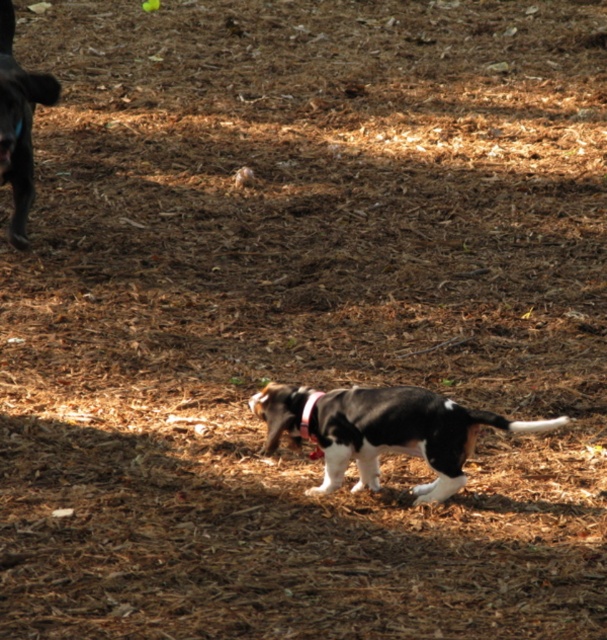
Image resolution: width=607 pixels, height=640 pixels. What are the coordinates of `shiny black dog at upper left` in the screenshot? It's located at (x=18, y=124).

Based on the photo, is black and white fur dog at center above shiny black dog at upper left?

Incorrect, black and white fur dog at center is not positioned above shiny black dog at upper left.

Does black and white fur dog at center have a lesser width compared to shiny black dog at upper left?

No.

You are a GUI agent. You are given a task and a screenshot of the screen. Output one action in this format:
    pyautogui.click(x=<x>, y=<y>)
    Task: Click on the black and white fur dog at center
    
    Given the screenshot: What is the action you would take?
    pyautogui.click(x=401, y=435)

Between black and white fur dog at center and black fabric neckband at center, which one appears on the left side from the viewer's perspective?

black fabric neckband at center

Between point (337, 472) and point (317, 444), which one is positioned in front?

Point (337, 472) is in front.

Locate an element on the screen. The height and width of the screenshot is (640, 607). black and white fur dog at center is located at coordinates (401, 435).